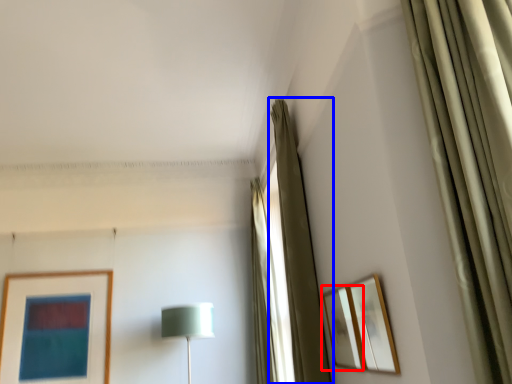
Question: Which object appears closest to the camera in this image, picture frame (highlighted by a red box) or curtain (highlighted by a blue box)?

Choices:
 (A) picture frame
 (B) curtain

Answer: (A)